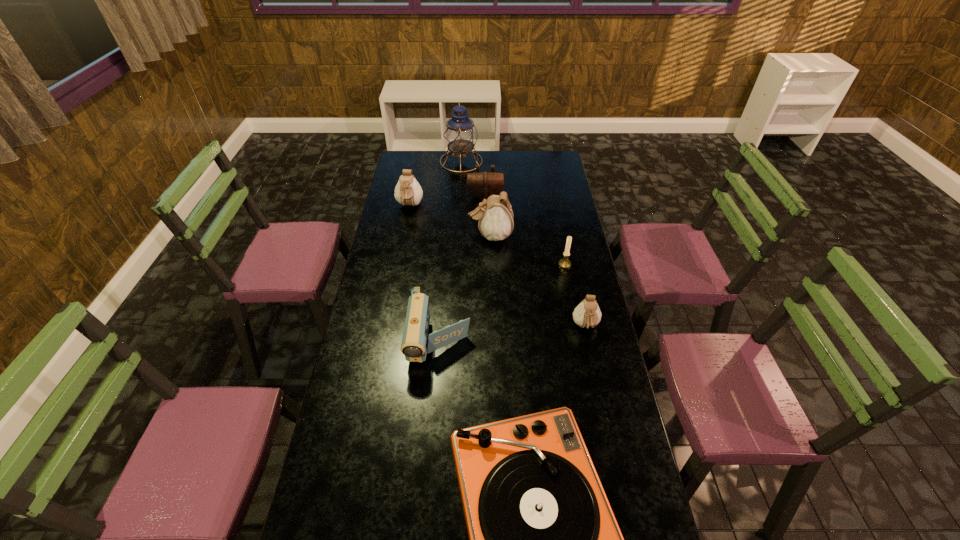
I want to click on vacant space that is in between the camcorder and the farthest object, so click(450, 251).

At what (x,y) coordinates should I click in order to perform the action: click on vacant space in between the camcorder and the lantern. Please return your answer as a coordinate pair (x, y). Image resolution: width=960 pixels, height=540 pixels. Looking at the image, I should click on (450, 251).

The height and width of the screenshot is (540, 960). Find the location of `vacant area between the leftmost object and the brown pouch`. vacant area between the leftmost object and the brown pouch is located at coordinates (447, 201).

Locate an element on the screen. free space between the camcorder and the brown pouch is located at coordinates (463, 269).

Choose which object is the second nearest neighbor to the farthest object. Please provide its 2D coordinates. Your answer should be formatted as a tuple, i.e. [(x, y)], where the tuple contains the x and y coordinates of a point satisfying the conditions above.

[(408, 192)]

You are a GUI agent. You are given a task and a screenshot of the screen. Output one action in this format:
    pyautogui.click(x=<x>, y=<y>)
    Task: Click on the object that is the third nearest to the lantern
    This screenshot has width=960, height=540.
    Given the screenshot: What is the action you would take?
    pyautogui.click(x=496, y=221)

At what (x,y) coordinates should I click in order to perform the action: click on the closest pouch to the second white pouch from left to right. Please return your answer as a coordinate pair (x, y). This screenshot has height=540, width=960. Looking at the image, I should click on (482, 185).

Where is `pouch that is the fourth closest to the record player`? pouch that is the fourth closest to the record player is located at coordinates [x=482, y=185].

Locate which white pouch is the second closest to the fifth farthest object. Please provide its 2D coordinates. Your answer should be formatted as a tuple, i.e. [(x, y)], where the tuple contains the x and y coordinates of a point satisfying the conditions above.

[(587, 314)]

Image resolution: width=960 pixels, height=540 pixels. Identify the location of the closest white pouch relative to the leftmost white pouch. pos(496,221).